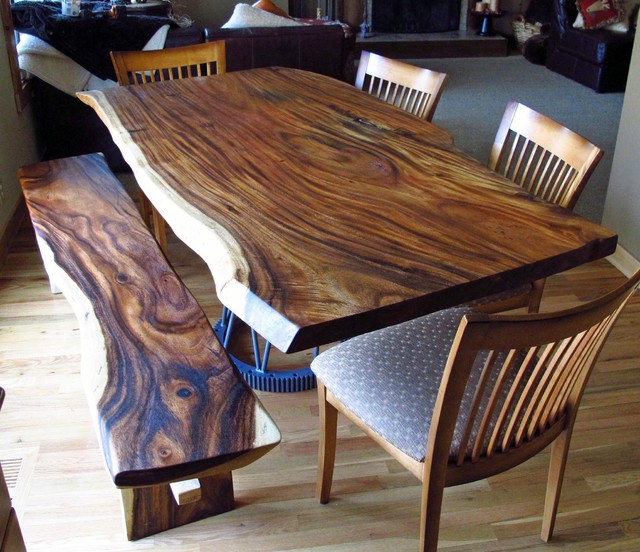
The width and height of the screenshot is (640, 552). I want to click on wooden tabletop, so click(267, 153).